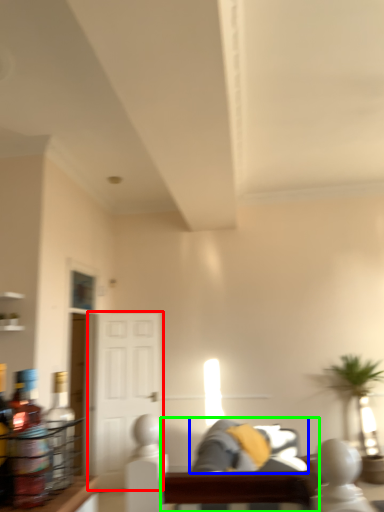
Question: Which is nearer to the glass door (highlighted by a red box)? couch (highlighted by a blue box) or couch (highlighted by a green box).

Choices:
 (A) couch
 (B) couch

Answer: (A)